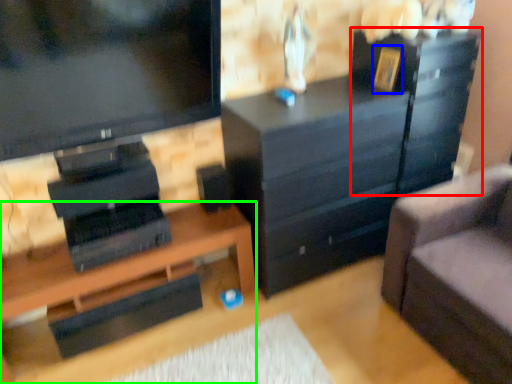
Question: Which is nearer to the file cabinet (highlighted by a red box)? picture frame (highlighted by a blue box) or desk (highlighted by a green box).

Choices:
 (A) picture frame
 (B) desk

Answer: (A)